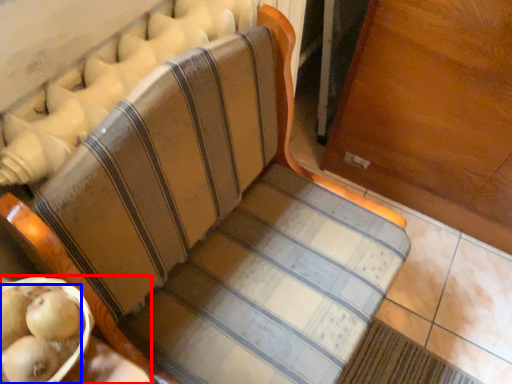
Question: Which of the following is the closest to the observer, table (highlighted by a red box) or fruit (highlighted by a blue box)?

Choices:
 (A) table
 (B) fruit

Answer: (A)